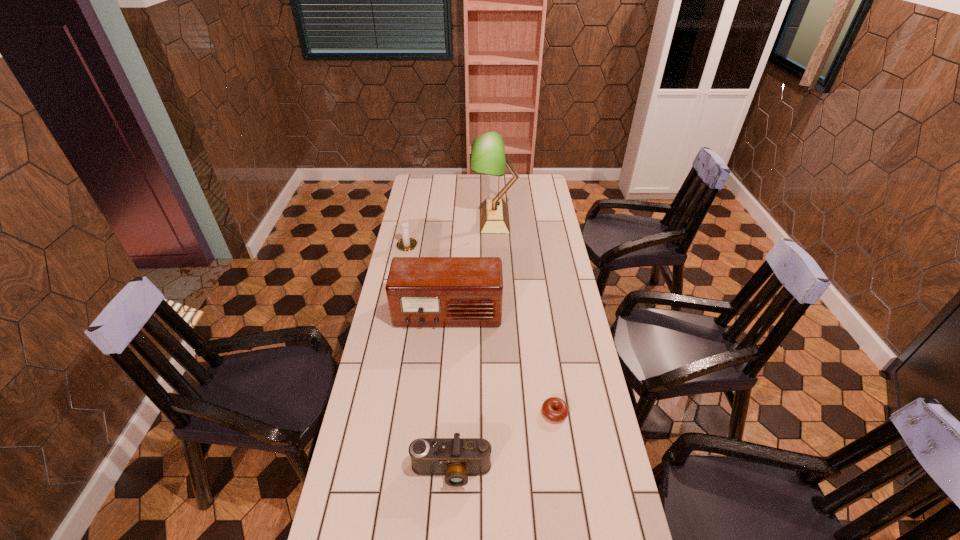
The width and height of the screenshot is (960, 540). Identify the location of unoccupied area between the rightmost object and the camera. (503, 442).

You are a GUI agent. You are given a task and a screenshot of the screen. Output one action in this format:
    pyautogui.click(x=<x>, y=<y>)
    Task: Click on the vacant space that's between the nearest object and the shortest object
    
    Given the screenshot: What is the action you would take?
    pyautogui.click(x=503, y=442)

You are a GUI agent. You are given a task and a screenshot of the screen. Output one action in this format:
    pyautogui.click(x=<x>, y=<y>)
    Task: Click on the free space between the fourth farthest object and the third shortest object
    The width and height of the screenshot is (960, 540).
    Given the screenshot: What is the action you would take?
    pyautogui.click(x=481, y=328)

Where is `free area in between the second nearest object and the table lamp`? This screenshot has height=540, width=960. free area in between the second nearest object and the table lamp is located at coordinates (524, 316).

In order to click on object that can be found as the second closest to the fourth tallest object in this screenshot , I will do `click(421, 291)`.

Identify the location of object that is the closest one to the farthest object. (405, 244).

Find the location of a particular element. This screenshot has width=960, height=540. blank space that satisfies the following two spatial constraints: 1. on the front-facing side of the radio receiver; 2. on the left side of the shortest object is located at coordinates (441, 413).

Where is `vacant position in the image that satisfies the following two spatial constraints: 1. on the metallic stand of the tallest object; 2. on the lens of the nearest object`? The image size is (960, 540). vacant position in the image that satisfies the following two spatial constraints: 1. on the metallic stand of the tallest object; 2. on the lens of the nearest object is located at coordinates (506, 471).